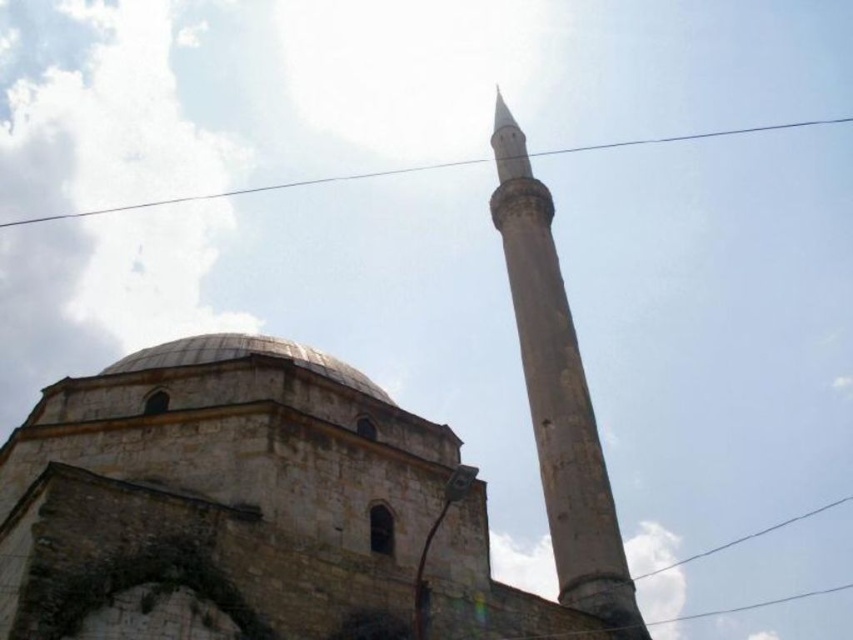
You are an architect analyzing the structure of the mosque. Which object has a smaller width between the smooth stone minaret at center and the clear wire at upper center?

The smooth stone minaret at center has a lesser width compared to the clear wire at upper center.

Based on the photo, looking at the historical mosque, where is the gray stone dome at center in relation to the clear wire at upper center?

The gray stone dome at center is located to the left of the clear wire at upper center.